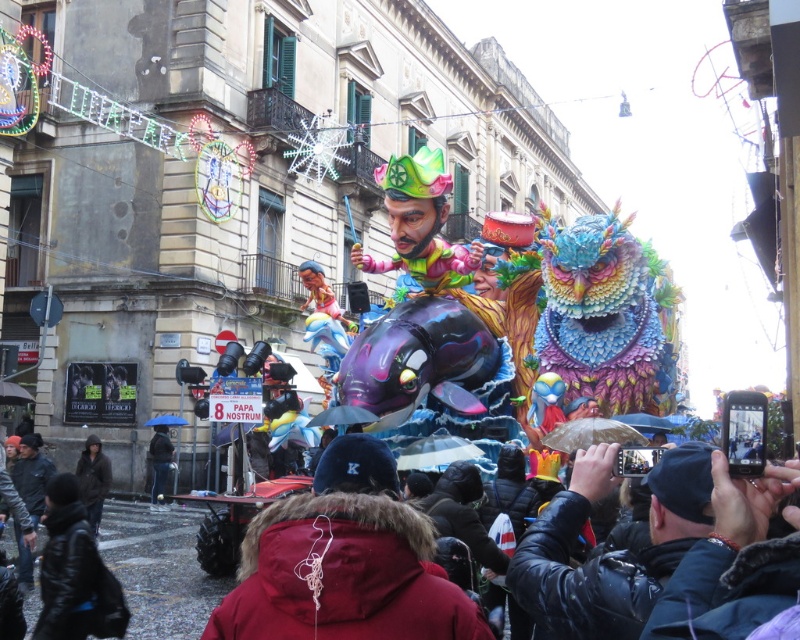
Based on the photo, is red fur coat at center taller than dark blue leather jacket at lower right?

Yes.

Locate an element on the screen. The width and height of the screenshot is (800, 640). red fur coat at center is located at coordinates (344, 561).

Who is taller, dark blue leather jacket at lower right or dark brown leather jacket at lower left?

With more height is dark blue leather jacket at lower right.

This screenshot has height=640, width=800. I want to click on dark blue leather jacket at lower right, so click(609, 550).

The height and width of the screenshot is (640, 800). What are the coordinates of `dark blue leather jacket at lower right` in the screenshot? It's located at (609, 550).

Does red fur coat at center have a larger size compared to dark brown leather jacket at lower left?

Indeed, red fur coat at center has a larger size compared to dark brown leather jacket at lower left.

Does red fur coat at center lie behind dark brown leather jacket at lower left?

No, red fur coat at center is closer to the viewer.

Measure the distance between red fur coat at center and camera.

red fur coat at center and camera are 93.06 feet apart from each other.

The height and width of the screenshot is (640, 800). I want to click on red fur coat at center, so click(x=344, y=561).